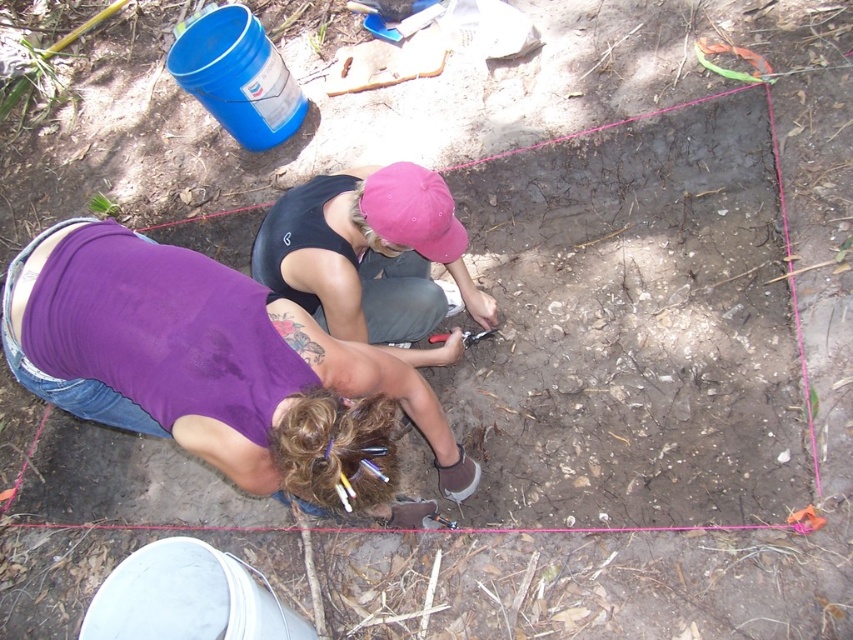
You are an archaeologist who needs to hand a tool to your colleague. You are standing at the purple fabric shirt at lower left and your colleague is at the pink fabric cap at center. How far apart are you and your colleague?

The distance between the purple fabric shirt at lower left and the pink fabric cap at center is 18.18 inches.

You are an archaeologist observing the excavation site. You notice the purple fabric shirt at lower left and the pink fabric cap at center. Which object is closer to you, the observer?

The purple fabric shirt at lower left is closer to you because it is in front of the pink fabric cap at center.